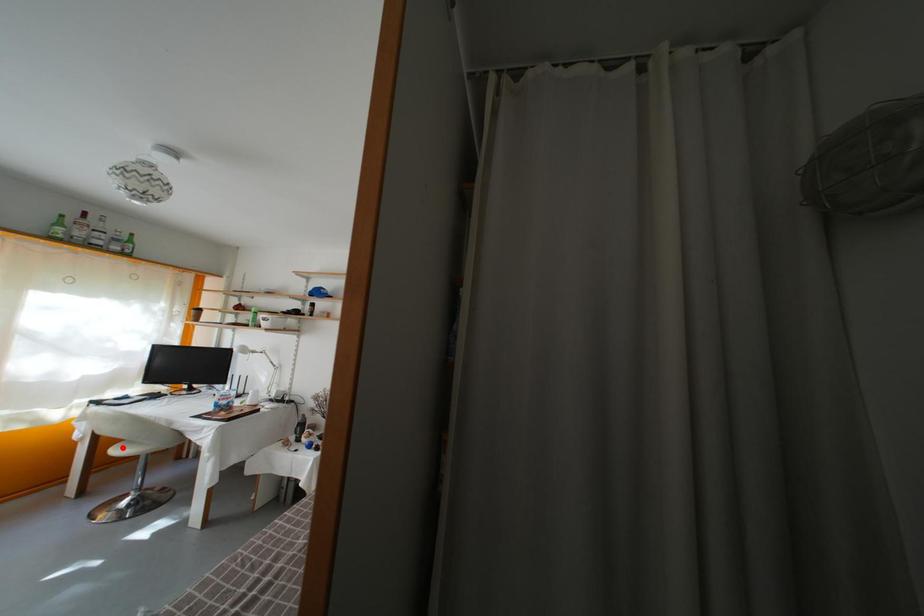
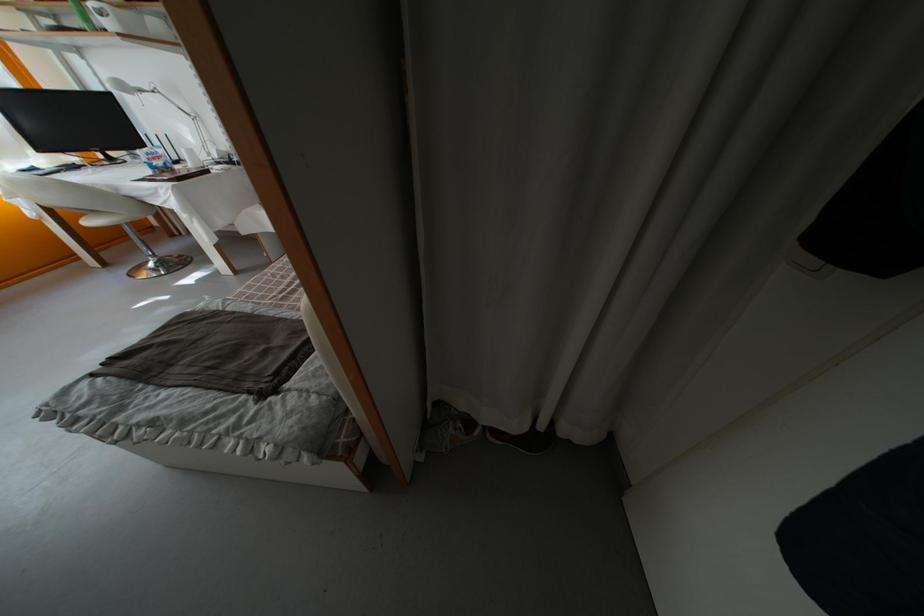
Question: I am providing you with two images of the same scene from different viewpoints. Image1 has a red point marked. In image2, the corresponding 3D location appears at what relative position? Reply with the corresponding letter.

Choices:
 (A) Closer
 (B) Farther

Answer: (B)